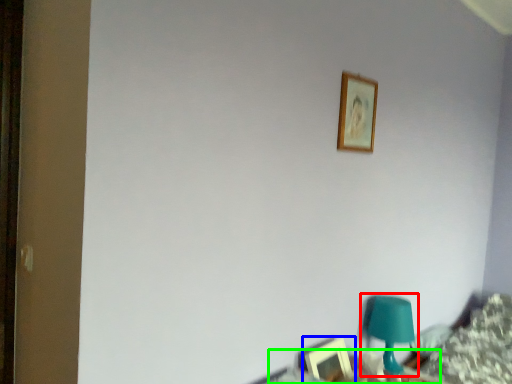
Question: Based on their relative distances, which object is nearer to table lamp (highlighted by a red box)? Choose from picture frame (highlighted by a blue box) and table (highlighted by a green box).

Choices:
 (A) picture frame
 (B) table

Answer: (B)